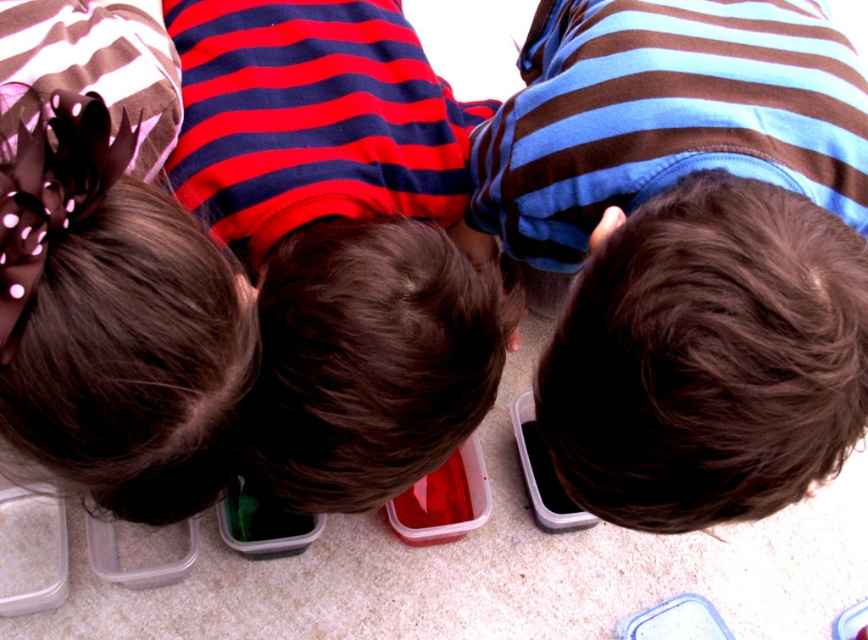
Question: Can you confirm if brown striped shirt at center is bigger than red striped shirt at center?

Choices:
 (A) no
 (B) yes

Answer: (B)

Question: Which object appears farthest from the camera in this image?

Choices:
 (A) brown striped shirt at center
 (B) red striped shirt at center

Answer: (B)

Question: From the image, what is the correct spatial relationship of brown striped shirt at center in relation to red striped shirt at center?

Choices:
 (A) left
 (B) right

Answer: (B)

Question: Is brown striped shirt at center further to the viewer compared to red striped shirt at center?

Choices:
 (A) yes
 (B) no

Answer: (B)